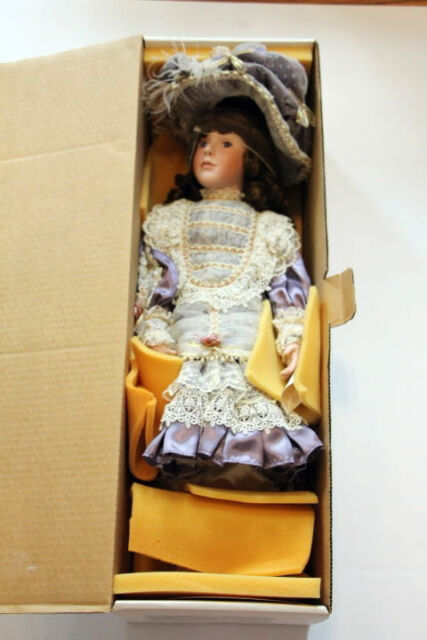
Find the location of a particular element. The width and height of the screenshot is (427, 640). lace is located at coordinates (201, 393).